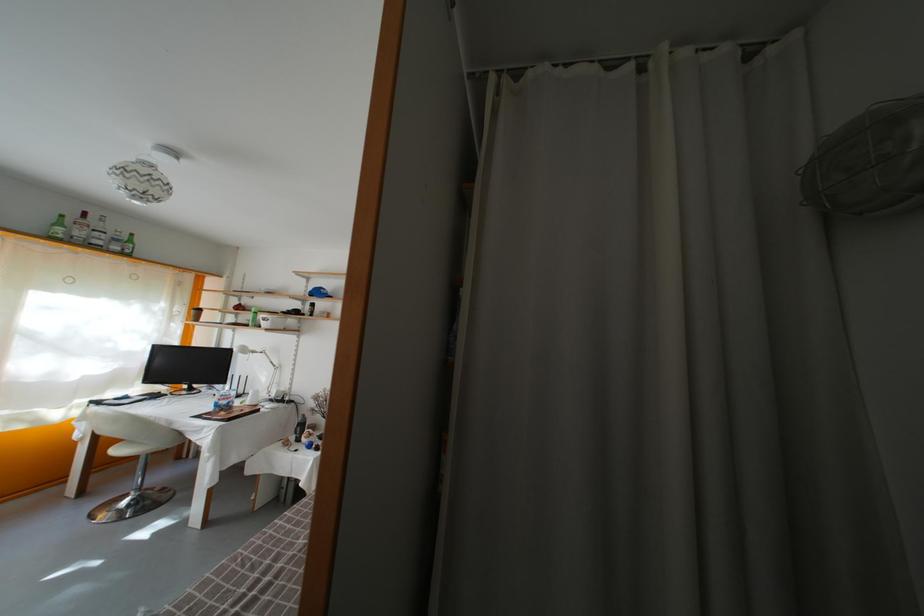
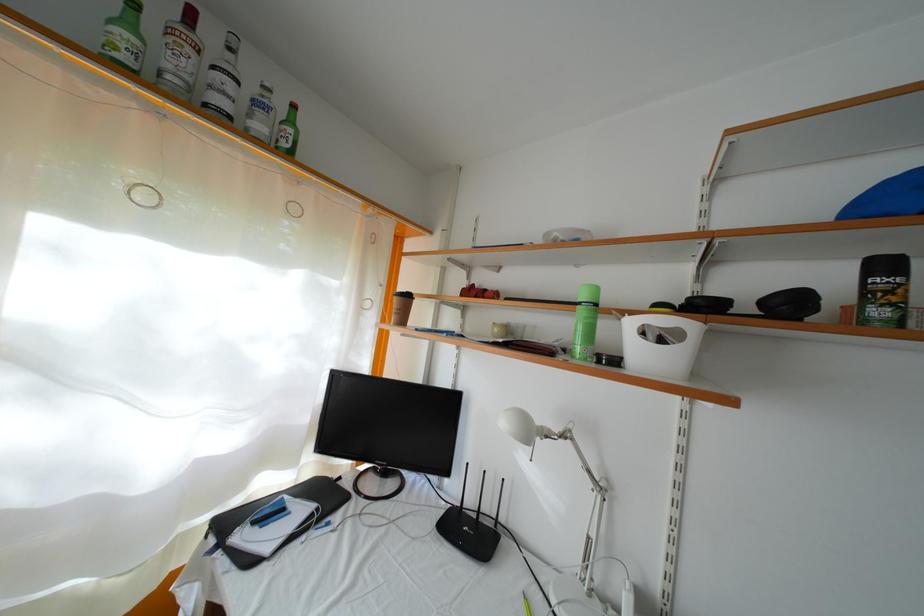
Locate, in the second image, the point that corresponds to the point at 122,254 in the first image.

(264, 134)